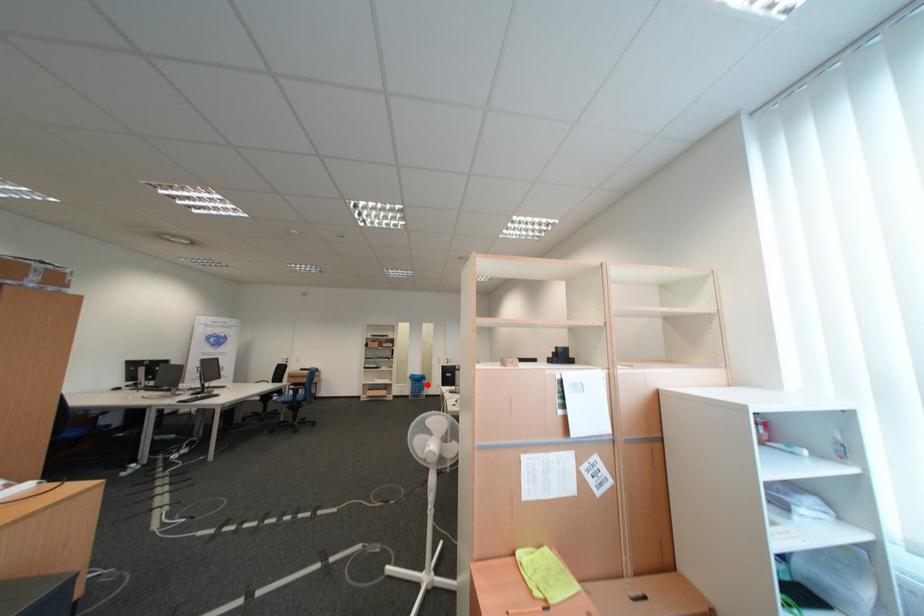
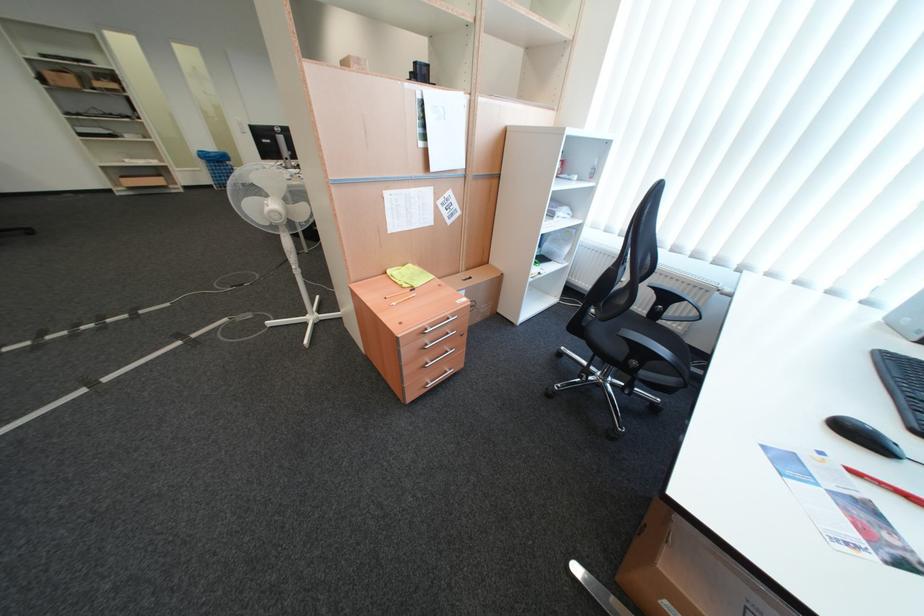
Question: I am providing you with two images of the same scene from different viewpoints. In image1, a red point is highlighted. Considering the same 3D point in image2, which of the following is correct?

Choices:
 (A) It is closer
 (B) It is farther

Answer: (A)